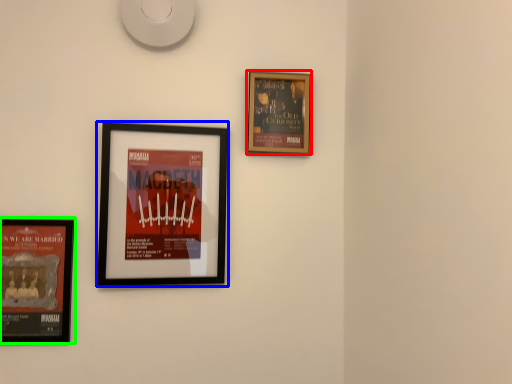
Question: Which object is positioned closest to picture frame (highlighted by a red box)? Select from picture frame (highlighted by a blue box) and picture frame (highlighted by a green box).

Choices:
 (A) picture frame
 (B) picture frame

Answer: (A)